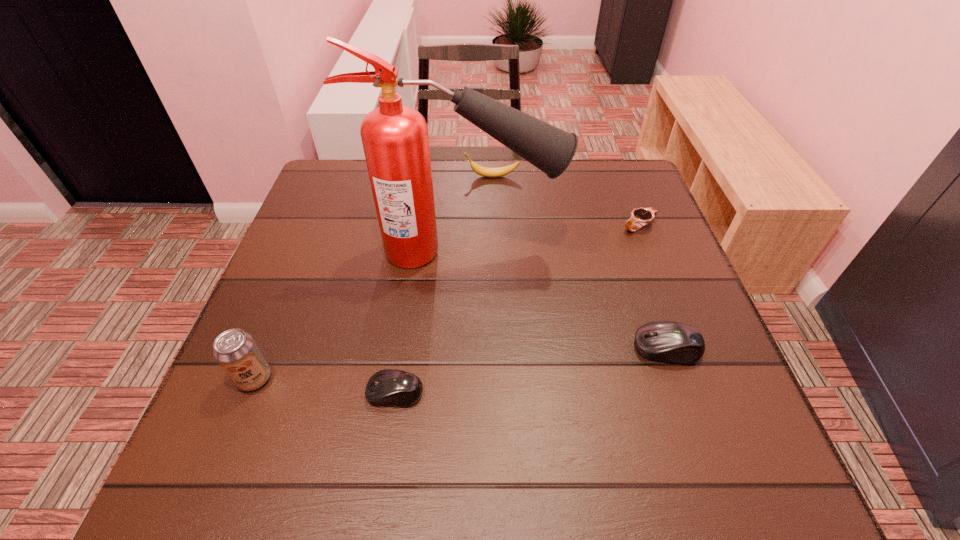
If equal spacing is the goal by inserting an additional mouse_(computer_equipment) among them, please point out a vacant space for this new mouse_(computer_equipment). Please provide its 2D coordinates. Your answer should be formatted as a tuple, i.e. [(x, y)], where the tuple contains the x and y coordinates of a point satisfying the conditions above.

[(537, 369)]